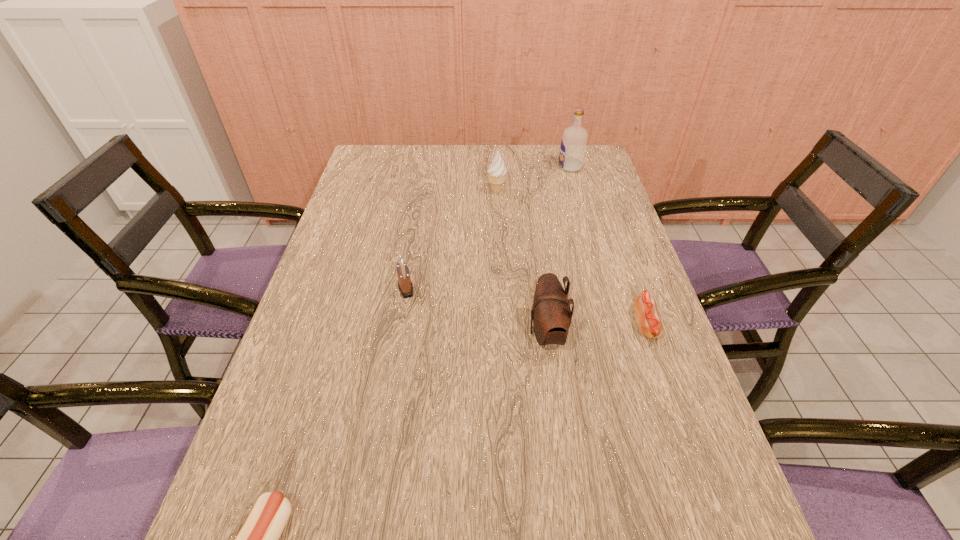
Where is `vacant point located between the second object from left to right and the tallest object`? Image resolution: width=960 pixels, height=540 pixels. vacant point located between the second object from left to right and the tallest object is located at coordinates (488, 228).

Image resolution: width=960 pixels, height=540 pixels. Identify the location of free space between the fifth object from left to right and the fourth object from right to left. (534, 179).

Locate an element on the screen. The image size is (960, 540). unoccupied area between the farther sausage and the third object from left to right is located at coordinates (571, 258).

The image size is (960, 540). In order to click on free space between the third farthest object and the icecream in this screenshot , I will do `click(451, 240)`.

Select which object is the second closest to the nearer sausage. Please provide its 2D coordinates. Your answer should be formatted as a tuple, i.e. [(x, y)], where the tuple contains the x and y coordinates of a point satisfying the conditions above.

[(551, 315)]

Locate which object ranks third in proximity to the third object from left to right. Please provide its 2D coordinates. Your answer should be formatted as a tuple, i.e. [(x, y)], where the tuple contains the x and y coordinates of a point satisfying the conditions above.

[(551, 315)]

The height and width of the screenshot is (540, 960). I want to click on free space that satisfies the following two spatial constraints: 1. on the back side of the farther sausage; 2. on the front-facing side of the second farthest object, so click(x=599, y=192).

Locate an element on the screen. This screenshot has width=960, height=540. vacant space that satisfies the following two spatial constraints: 1. on the front side of the farther sausage; 2. with the flap open on the pouch is located at coordinates (649, 333).

The image size is (960, 540). Identify the location of blank area in the image that satisfies the following two spatial constraints: 1. on the label of the rightmost object; 2. on the right side of the tallest object. (614, 325).